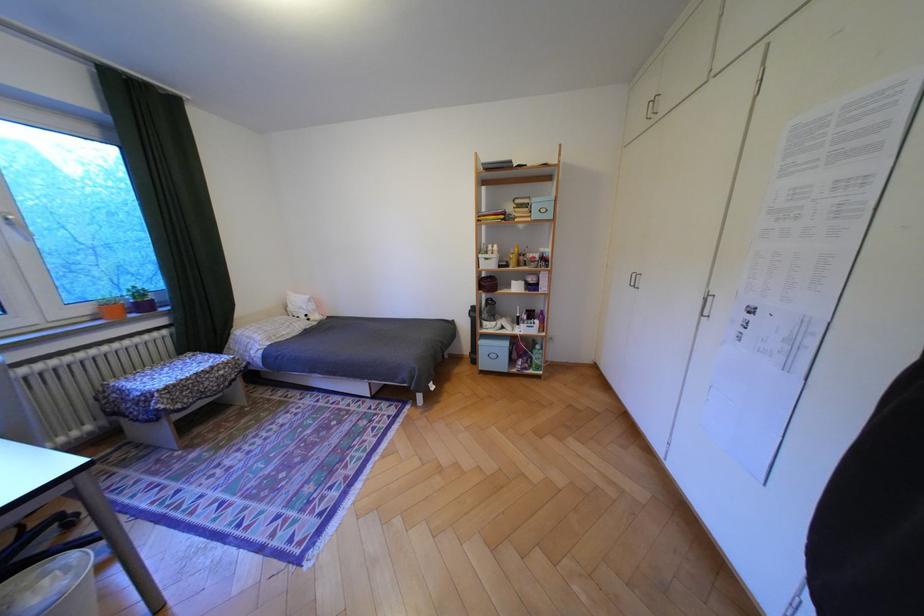
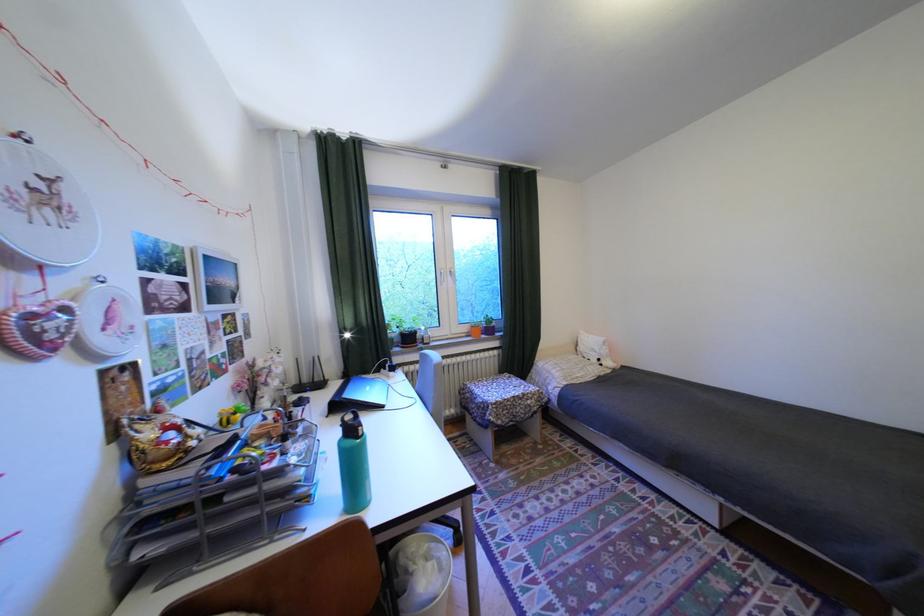
Where in the second image is the point corresponding to (56,582) from the first image?

(442, 565)